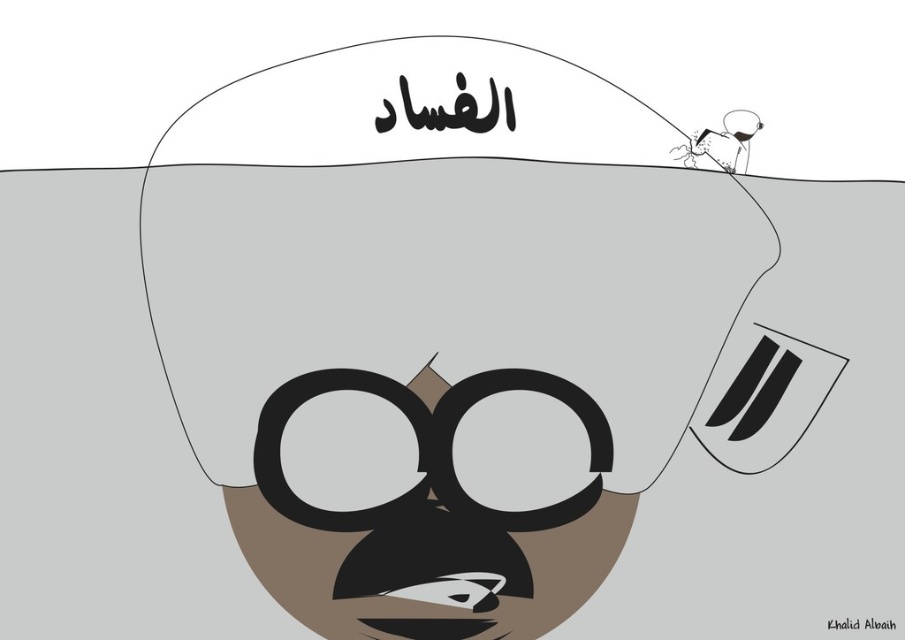
Is point (329, 461) positioned in front of point (711, 136)?

Yes, point (329, 461) is closer to viewer.

Does point (597, 435) come closer to viewer compared to point (751, 134)?

Yes.

The height and width of the screenshot is (640, 905). Find the location of `white matte helmet at upper center`. white matte helmet at upper center is located at coordinates (454, 330).

Does point (775, 449) come closer to viewer compared to point (561, 401)?

Yes, point (775, 449) is in front of point (561, 401).

I want to click on white matte helmet at upper center, so click(454, 330).

What do you see at coordinates (454, 330) in the screenshot? This screenshot has width=905, height=640. I see `white matte helmet at upper center` at bounding box center [454, 330].

At what (x,y) coordinates should I click in order to perform the action: click on white matte helmet at upper center. Please return your answer as a coordinate pair (x, y). The image size is (905, 640). Looking at the image, I should click on (454, 330).

Consider the image. Does black matte goggles at center appear over smooth white figure at upper right?

Incorrect, black matte goggles at center is not positioned above smooth white figure at upper right.

Can you confirm if black matte goggles at center is shorter than smooth white figure at upper right?

No, black matte goggles at center is not shorter than smooth white figure at upper right.

Where is `black matte goggles at center`? black matte goggles at center is located at coordinates click(426, 448).